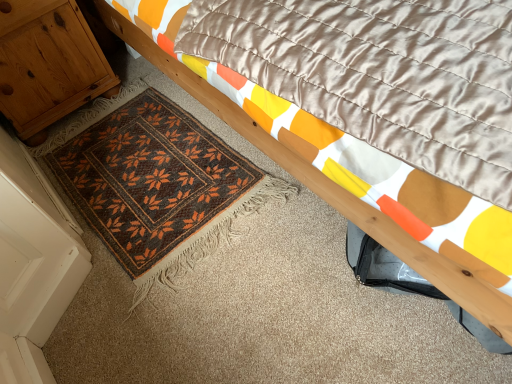
Question: Are wooden bed frame at upper right and wooden cabinet at left located far from each other?

Choices:
 (A) yes
 (B) no

Answer: (B)

Question: Does wooden bed frame at upper right have a greater width compared to wooden cabinet at left?

Choices:
 (A) yes
 (B) no

Answer: (A)

Question: From the image's perspective, does wooden bed frame at upper right appear lower than wooden cabinet at left?

Choices:
 (A) yes
 (B) no

Answer: (A)

Question: From a real-world perspective, is wooden bed frame at upper right located higher than wooden cabinet at left?

Choices:
 (A) yes
 (B) no

Answer: (A)

Question: Is wooden bed frame at upper right positioned with its back to wooden cabinet at left?

Choices:
 (A) no
 (B) yes

Answer: (B)

Question: From a real-world perspective, is wooden bed frame at upper right positioned under wooden cabinet at left based on gravity?

Choices:
 (A) yes
 (B) no

Answer: (B)

Question: Does brown woven mat at lower left have a smaller size compared to wooden cabinet at left?

Choices:
 (A) yes
 (B) no

Answer: (A)

Question: Is brown woven mat at lower left positioned far away from wooden cabinet at left?

Choices:
 (A) no
 (B) yes

Answer: (A)

Question: Is the depth of brown woven mat at lower left greater than that of wooden cabinet at left?

Choices:
 (A) no
 (B) yes

Answer: (A)

Question: From the image's perspective, is brown woven mat at lower left under wooden cabinet at left?

Choices:
 (A) yes
 (B) no

Answer: (A)

Question: From a real-world perspective, is brown woven mat at lower left physically above wooden cabinet at left?

Choices:
 (A) yes
 (B) no

Answer: (B)

Question: Does brown woven mat at lower left have a lesser width compared to wooden cabinet at left?

Choices:
 (A) yes
 (B) no

Answer: (B)

Question: From a real-world perspective, is wooden cabinet at left under brown woven mat at lower left?

Choices:
 (A) yes
 (B) no

Answer: (B)